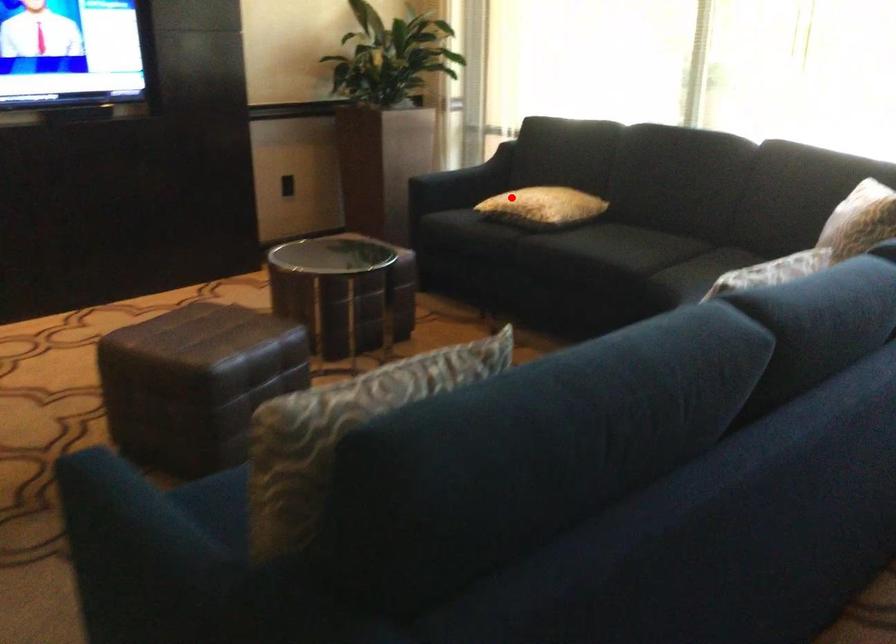
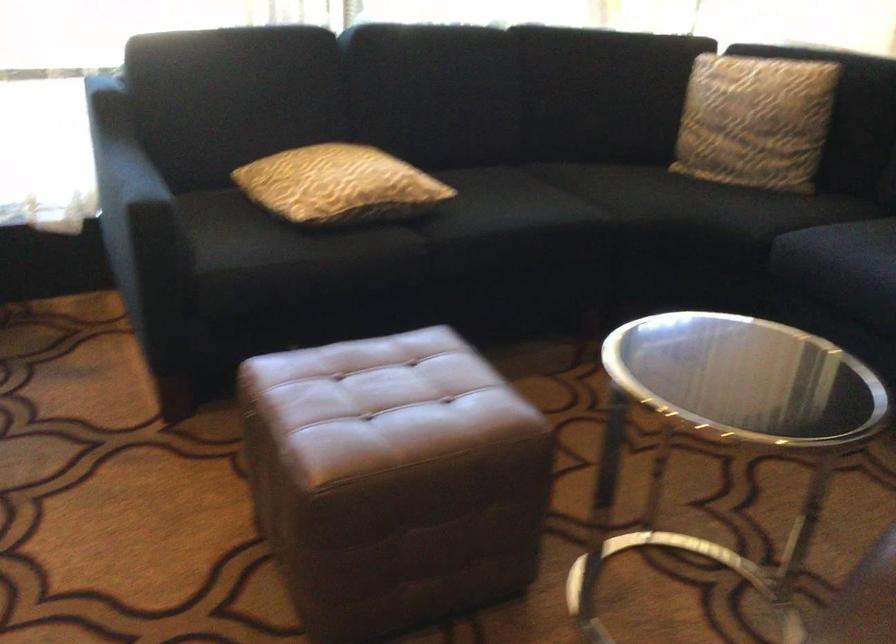
Question: I am providing you with two images of the same scene from different viewpoints. Image1 has a red point marked. In image2, the corresponding 3D location appears at what relative position? Reply with the corresponding letter.

Choices:
 (A) Closer
 (B) Farther

Answer: (A)